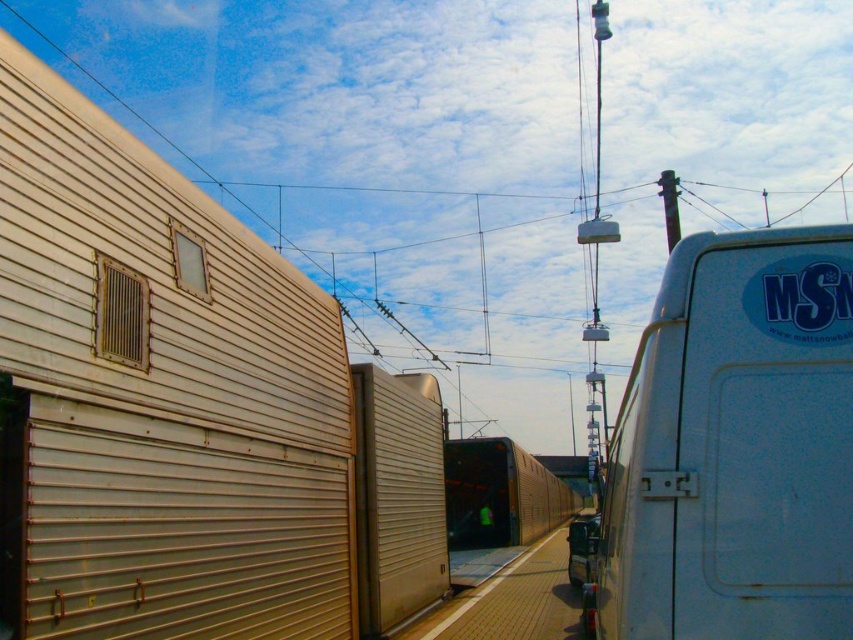
Question: Is white speckled van at right positioned before metallic silver train at center?

Choices:
 (A) yes
 (B) no

Answer: (A)

Question: Among these points, which one is nearest to the camera?

Choices:
 (A) (498, 484)
 (B) (738, 493)

Answer: (B)

Question: Can you confirm if white speckled van at right is smaller than metallic silver train at center?

Choices:
 (A) yes
 (B) no

Answer: (A)

Question: In this image, where is white speckled van at right located relative to metallic silver train at center?

Choices:
 (A) above
 (B) below

Answer: (A)